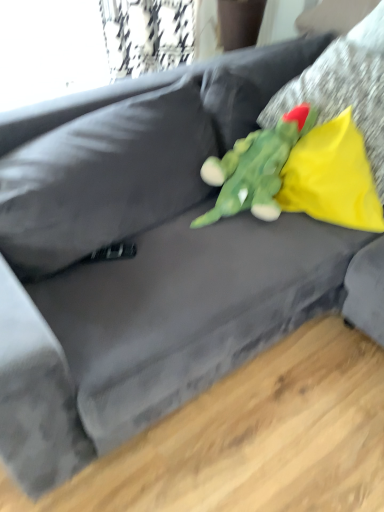
Locate an element on the screen. green plush toy at center is located at coordinates (255, 168).

Image resolution: width=384 pixels, height=512 pixels. I want to click on yellow fabric pillow at upper right, which ranks as the 2th pillow in bottom-to-top order, so click(x=345, y=88).

How different are the orientations of green plush toy at center and yellow fabric pillow at upper right, the 1th pillow in the bottom-to-top sequence, in degrees?

The angular difference between green plush toy at center and yellow fabric pillow at upper right, the 1th pillow in the bottom-to-top sequence, is 69.7 degrees.

Is yellow fabric pillow at upper right, the 1th pillow in the bottom-to-top sequence, inside green plush toy at center?

No, yellow fabric pillow at upper right, the 1th pillow in the bottom-to-top sequence, is not a part of green plush toy at center.

Is green plush toy at center oriented towards yellow fabric pillow at upper right, the 1th pillow in the bottom-to-top sequence?

Yes, green plush toy at center faces towards yellow fabric pillow at upper right, the 1th pillow in the bottom-to-top sequence.

Is point (291, 142) more distant than point (329, 150)?

Yes, it is behind point (329, 150).

From the image's perspective, is yellow fabric pillow at upper right, the 1th pillow in the bottom-to-top sequence, located above yellow fabric pillow at upper right, which ranks as the first pillow in top-to-bottom order?

Incorrect, from the image's perspective, yellow fabric pillow at upper right, the 1th pillow in the bottom-to-top sequence, is lower than yellow fabric pillow at upper right, which ranks as the first pillow in top-to-bottom order.

Which is more to the right, yellow fabric pillow at upper right, the 1th pillow in the bottom-to-top sequence, or yellow fabric pillow at upper right, which ranks as the 2th pillow in bottom-to-top order?

From the viewer's perspective, yellow fabric pillow at upper right, which ranks as the 2th pillow in bottom-to-top order, appears more on the right side.

From a real-world perspective, is yellow fabric pillow at upper right, the 1th pillow in the bottom-to-top sequence, under yellow fabric pillow at upper right, which ranks as the 2th pillow in bottom-to-top order?

Yes, from a real-world perspective, yellow fabric pillow at upper right, the 1th pillow in the bottom-to-top sequence, is below yellow fabric pillow at upper right, which ranks as the 2th pillow in bottom-to-top order.

Is yellow fabric pillow at upper right, positioned as the 2th pillow in top-to-bottom order, closer to the viewer compared to yellow fabric pillow at upper right, which ranks as the first pillow in top-to-bottom order?

No, yellow fabric pillow at upper right, positioned as the 2th pillow in top-to-bottom order, is behind yellow fabric pillow at upper right, which ranks as the first pillow in top-to-bottom order.

Which is more to the right, yellow fabric pillow at upper right, which ranks as the first pillow in top-to-bottom order, or green plush toy at center?

yellow fabric pillow at upper right, which ranks as the first pillow in top-to-bottom order.

Do you think yellow fabric pillow at upper right, which ranks as the 2th pillow in bottom-to-top order, is within green plush toy at center, or outside of it?

yellow fabric pillow at upper right, which ranks as the 2th pillow in bottom-to-top order, lies outside green plush toy at center.

Looking at their sizes, would you say yellow fabric pillow at upper right, which ranks as the 2th pillow in bottom-to-top order, is wider or thinner than green plush toy at center?

Considering their sizes, yellow fabric pillow at upper right, which ranks as the 2th pillow in bottom-to-top order, looks broader than green plush toy at center.

Who is smaller, yellow fabric pillow at upper right, which ranks as the 2th pillow in bottom-to-top order, or green plush toy at center?

Smaller between the two is green plush toy at center.

Is green plush toy at center next to yellow fabric pillow at upper right, which ranks as the first pillow in top-to-bottom order?

green plush toy at center and yellow fabric pillow at upper right, which ranks as the first pillow in top-to-bottom order, are clearly separated.

Considering the relative sizes of green plush toy at center and yellow fabric pillow at upper right, which ranks as the 2th pillow in bottom-to-top order, in the image provided, is green plush toy at center wider than yellow fabric pillow at upper right, which ranks as the 2th pillow in bottom-to-top order,?

Incorrect, the width of green plush toy at center does not surpass that of yellow fabric pillow at upper right, which ranks as the 2th pillow in bottom-to-top order.

How far apart are green plush toy at center and yellow fabric pillow at upper right, which ranks as the 2th pillow in bottom-to-top order?

green plush toy at center is 23.58 centimeters away from yellow fabric pillow at upper right, which ranks as the 2th pillow in bottom-to-top order.

From the image's perspective, is green plush toy at center beneath yellow fabric pillow at upper right, which ranks as the 2th pillow in bottom-to-top order?

Yes, from the image's perspective, green plush toy at center is below yellow fabric pillow at upper right, which ranks as the 2th pillow in bottom-to-top order.

The width and height of the screenshot is (384, 512). Find the location of `pillow that is above the yellow fabric pillow at upper right, positioned as the 2th pillow in top-to-bottom order (from the image's perspective)`. pillow that is above the yellow fabric pillow at upper right, positioned as the 2th pillow in top-to-bottom order (from the image's perspective) is located at coordinates (345, 88).

Is point (287, 105) positioned after point (301, 162)?

Yes, it is behind point (301, 162).

From a real-world perspective, is yellow fabric pillow at upper right, which ranks as the first pillow in top-to-bottom order, below yellow fabric pillow at upper right, positioned as the 2th pillow in top-to-bottom order?

No.

Is yellow fabric pillow at upper right, the 1th pillow in the bottom-to-top sequence, far from green plush toy at center?

No.

From a real-world perspective, who is located lower, yellow fabric pillow at upper right, positioned as the 2th pillow in top-to-bottom order, or green plush toy at center?

In real-world perspective, yellow fabric pillow at upper right, positioned as the 2th pillow in top-to-bottom order, is lower.

Where is `toy above the yellow fabric pillow at upper right, positioned as the 2th pillow in top-to-bottom order (from a real-world perspective)`? The width and height of the screenshot is (384, 512). toy above the yellow fabric pillow at upper right, positioned as the 2th pillow in top-to-bottom order (from a real-world perspective) is located at coordinates (255, 168).

Between yellow fabric pillow at upper right, the 1th pillow in the bottom-to-top sequence, and green plush toy at center, which one appears on the left side from the viewer's perspective?

green plush toy at center is more to the left.

Where is `pillow below the green plush toy at center (from a real-world perspective)`? pillow below the green plush toy at center (from a real-world perspective) is located at coordinates (332, 177).

The image size is (384, 512). I want to click on pillow in front of the yellow fabric pillow at upper right, positioned as the 2th pillow in top-to-bottom order, so click(x=345, y=88).

Considering their positions, is yellow fabric pillow at upper right, positioned as the 2th pillow in top-to-bottom order, positioned further to yellow fabric pillow at upper right, which ranks as the 2th pillow in bottom-to-top order, than green plush toy at center?

Among the two, green plush toy at center is located further to yellow fabric pillow at upper right, which ranks as the 2th pillow in bottom-to-top order.

In the scene shown: Which object lies nearer to the anchor point yellow fabric pillow at upper right, positioned as the 2th pillow in top-to-bottom order, green plush toy at center or yellow fabric pillow at upper right, which ranks as the first pillow in top-to-bottom order?

green plush toy at center is closer to yellow fabric pillow at upper right, positioned as the 2th pillow in top-to-bottom order.

Based on their spatial positions, is yellow fabric pillow at upper right, which ranks as the first pillow in top-to-bottom order, or green plush toy at center further from yellow fabric pillow at upper right, the 1th pillow in the bottom-to-top sequence?

yellow fabric pillow at upper right, which ranks as the first pillow in top-to-bottom order, lies further to yellow fabric pillow at upper right, the 1th pillow in the bottom-to-top sequence, than the other object.

From the picture: Considering their positions, is yellow fabric pillow at upper right, positioned as the 2th pillow in top-to-bottom order, positioned closer to green plush toy at center than yellow fabric pillow at upper right, which ranks as the 2th pillow in bottom-to-top order?

yellow fabric pillow at upper right, positioned as the 2th pillow in top-to-bottom order.

When comparing their distances from yellow fabric pillow at upper right, which ranks as the 2th pillow in bottom-to-top order, does green plush toy at center or yellow fabric pillow at upper right, the 1th pillow in the bottom-to-top sequence, seem further?

green plush toy at center is positioned further to the anchor yellow fabric pillow at upper right, which ranks as the 2th pillow in bottom-to-top order.

When comparing their distances from green plush toy at center, does yellow fabric pillow at upper right, which ranks as the 2th pillow in bottom-to-top order, or yellow fabric pillow at upper right, the 1th pillow in the bottom-to-top sequence, seem further?

yellow fabric pillow at upper right, which ranks as the 2th pillow in bottom-to-top order, lies further to green plush toy at center than the other object.

Where is `pillow situated between green plush toy at center and yellow fabric pillow at upper right, which ranks as the first pillow in top-to-bottom order, from left to right`? pillow situated between green plush toy at center and yellow fabric pillow at upper right, which ranks as the first pillow in top-to-bottom order, from left to right is located at coordinates (332, 177).